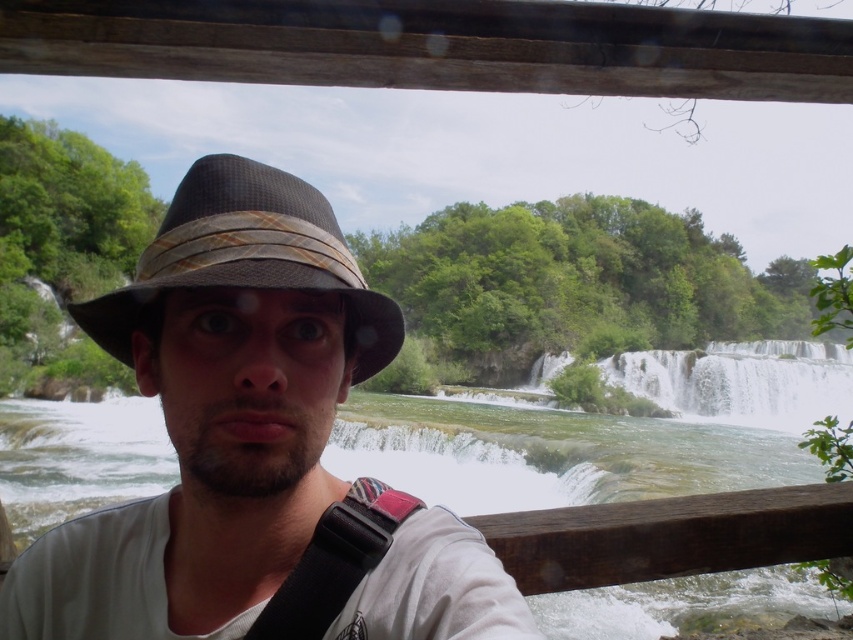
Question: Which point is farther to the camera?

Choices:
 (A) pos(305,582)
 (B) pos(169,394)
 (C) pos(231,173)

Answer: (B)

Question: Which point appears closest to the camera in this image?

Choices:
 (A) (325, 557)
 (B) (151, 314)
 (C) (204, 227)

Answer: (C)

Question: From the image, what is the correct spatial relationship of matte brown hat at center in relation to black leather strap at center?

Choices:
 (A) right
 (B) left

Answer: (B)

Question: Does matte brown hat at center come behind black leather strap at center?

Choices:
 (A) yes
 (B) no

Answer: (B)

Question: Which of the following is the closest to the observer?

Choices:
 (A) (173, 228)
 (B) (292, 589)
 (C) (292, 584)

Answer: (B)

Question: Can you confirm if matte brown hat at center is positioned to the left of black leather strap at center?

Choices:
 (A) no
 (B) yes

Answer: (B)